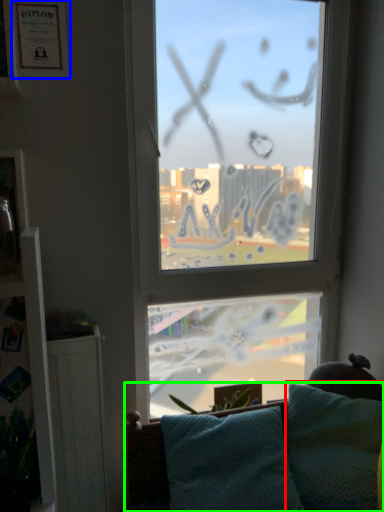
Question: Which object is the farthest from pillow (highlighted by a red box)? Choose among these: picture frame (highlighted by a blue box) or studio couch (highlighted by a green box).

Choices:
 (A) picture frame
 (B) studio couch

Answer: (A)